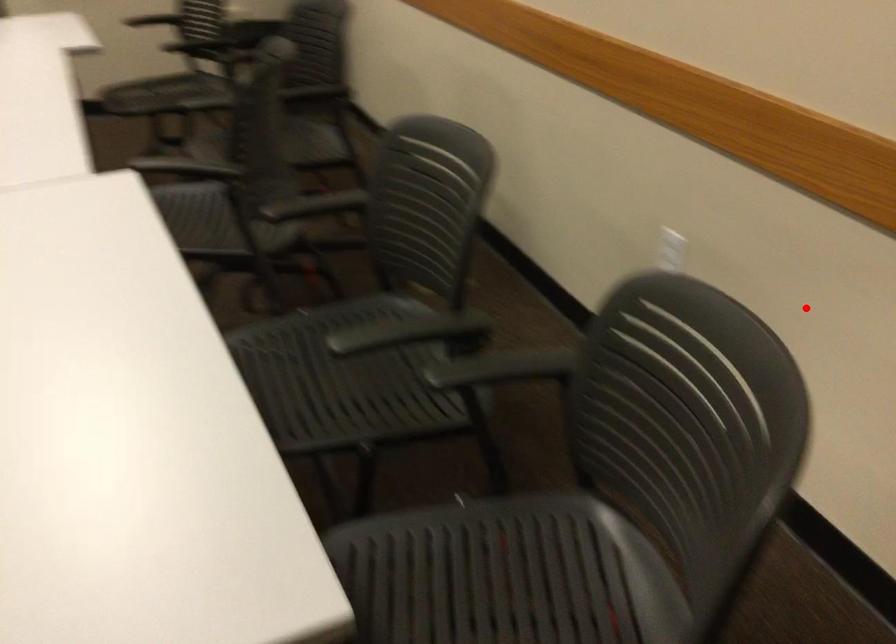
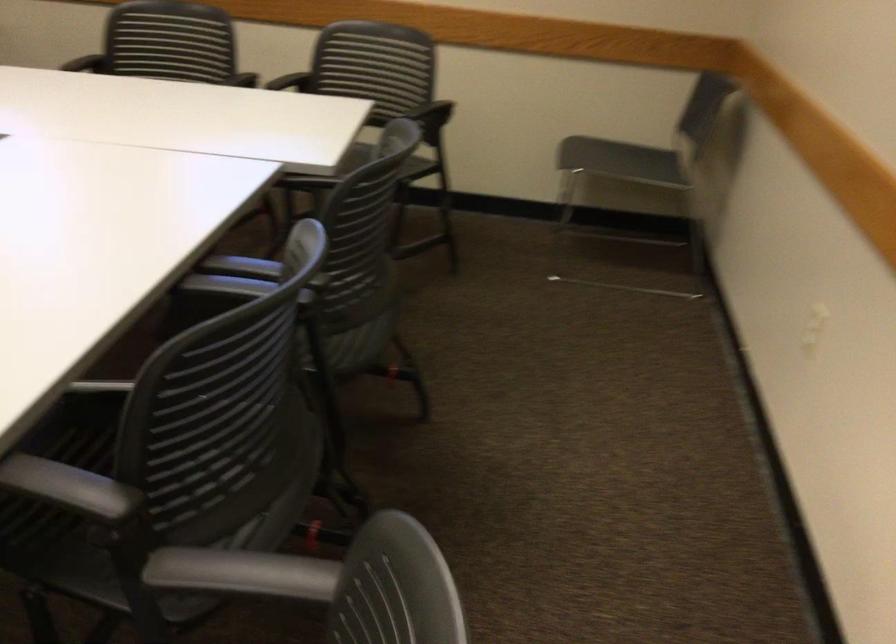
Locate, in the second image, the point that corresponds to the highlighted location in the first image.

(300, 75)